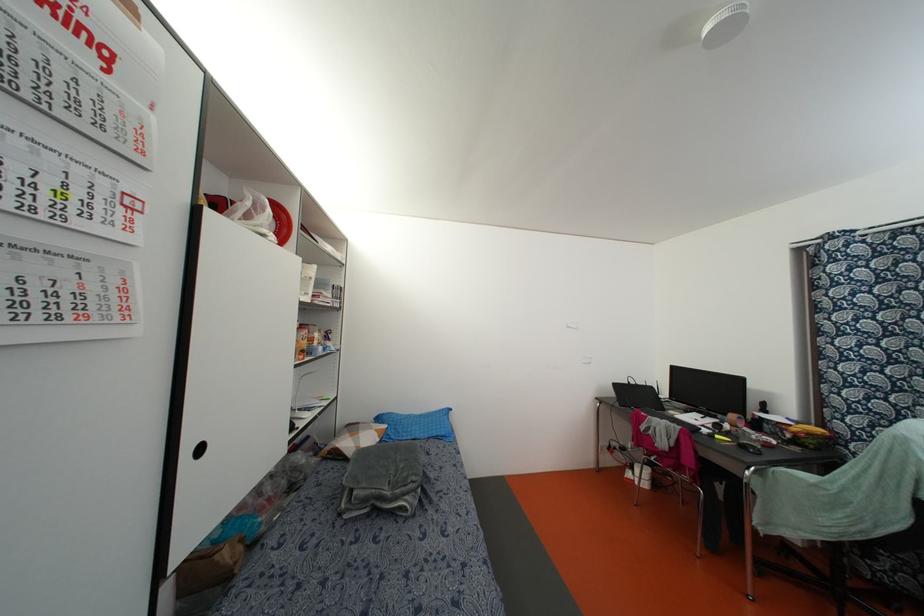
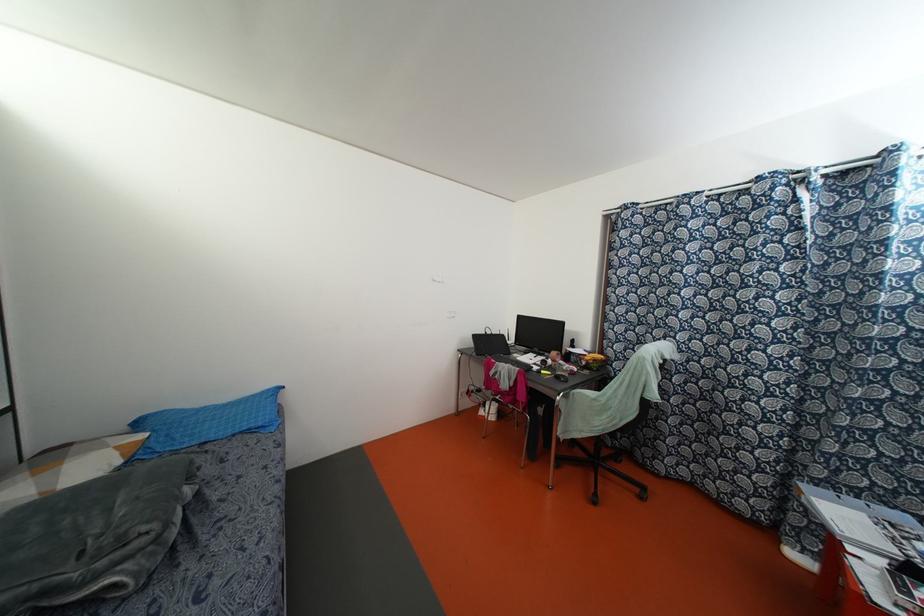
Consider the image. In a continuous first-person perspective shot, in which direction is the camera moving?

The cameraman walked toward right, forward.